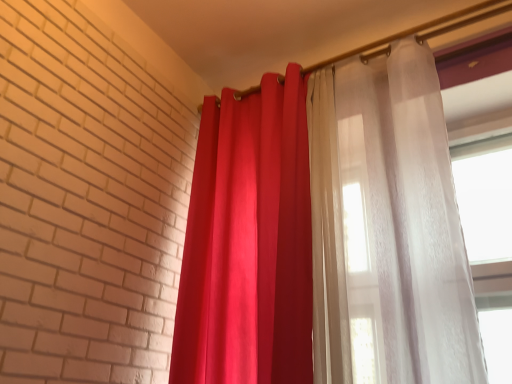
Question: From the image's perspective, is sheer white curtain at right, which is the first curtain in right-to-left order, above or below matte red curtain at center, acting as the 2th curtain starting from the right?

Choices:
 (A) below
 (B) above

Answer: (B)

Question: Looking at their shapes, would you say sheer white curtain at right, which appears as the 2th curtain when viewed from the left, is wider or thinner than matte red curtain at center, which is counted as the first curtain, starting from the left?

Choices:
 (A) thin
 (B) wide

Answer: (A)

Question: In the image, is sheer white curtain at right, which is the first curtain in right-to-left order, positioned in front of or behind matte red curtain at center, which is counted as the first curtain, starting from the left?

Choices:
 (A) behind
 (B) front

Answer: (B)

Question: Is point (192, 200) closer or farther from the camera than point (244, 236)?

Choices:
 (A) farther
 (B) closer

Answer: (A)

Question: Considering the positions of matte red curtain at center, which is counted as the first curtain, starting from the left, and sheer white curtain at right, which is the first curtain in right-to-left order, in the image, is matte red curtain at center, which is counted as the first curtain, starting from the left, wider or thinner than sheer white curtain at right, which is the first curtain in right-to-left order,?

Choices:
 (A) wide
 (B) thin

Answer: (A)

Question: Considering the positions of matte red curtain at center, acting as the 2th curtain starting from the right, and sheer white curtain at right, which appears as the 2th curtain when viewed from the left, in the image, is matte red curtain at center, acting as the 2th curtain starting from the right, bigger or smaller than sheer white curtain at right, which appears as the 2th curtain when viewed from the left,?

Choices:
 (A) big
 (B) small

Answer: (A)

Question: Choose the correct answer: Is matte red curtain at center, which is counted as the first curtain, starting from the left, inside sheer white curtain at right, which is the first curtain in right-to-left order, or outside it?

Choices:
 (A) outside
 (B) inside

Answer: (A)